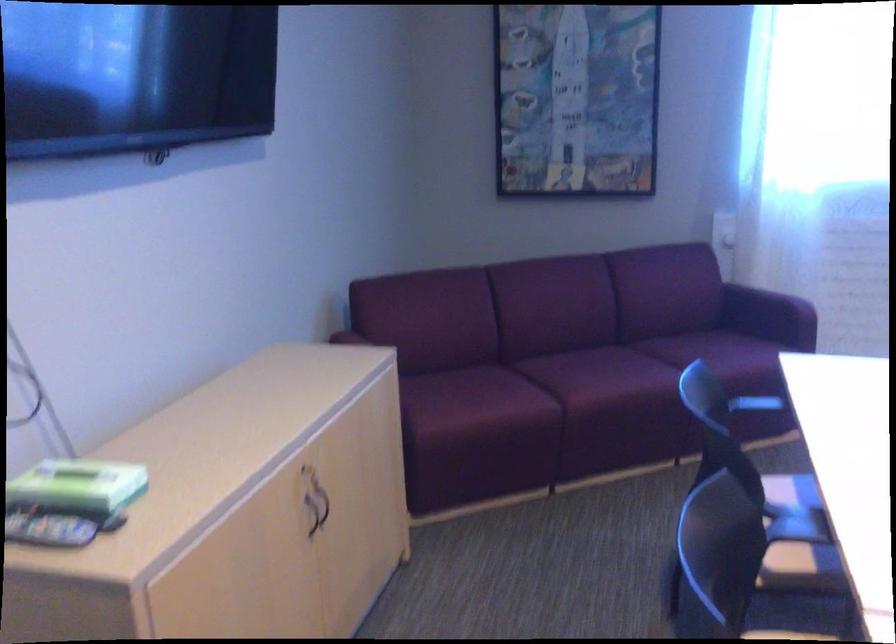
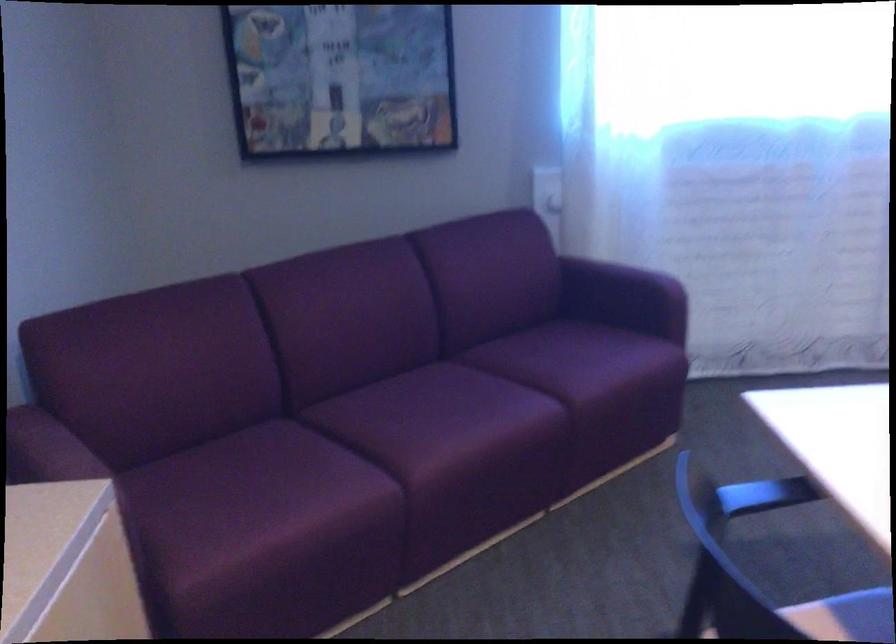
Question: Which direction would the cameraman need to move to produce the second image? Reply with the corresponding letter.

Choices:
 (A) Left
 (B) Right
 (C) Forward
 (D) Backward

Answer: (C)